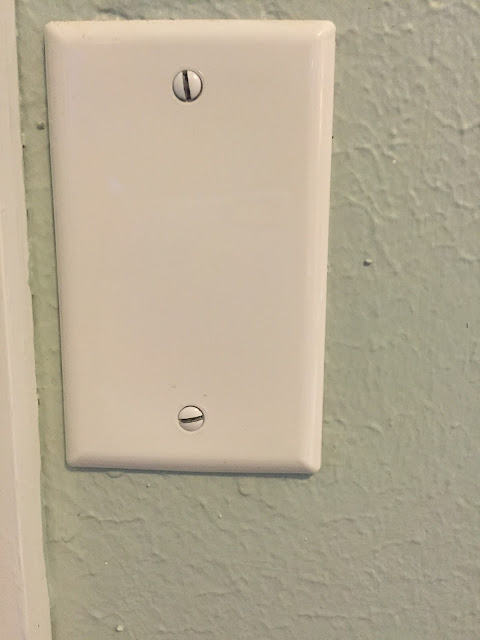
The image size is (480, 640). I want to click on wall, so click(406, 100).